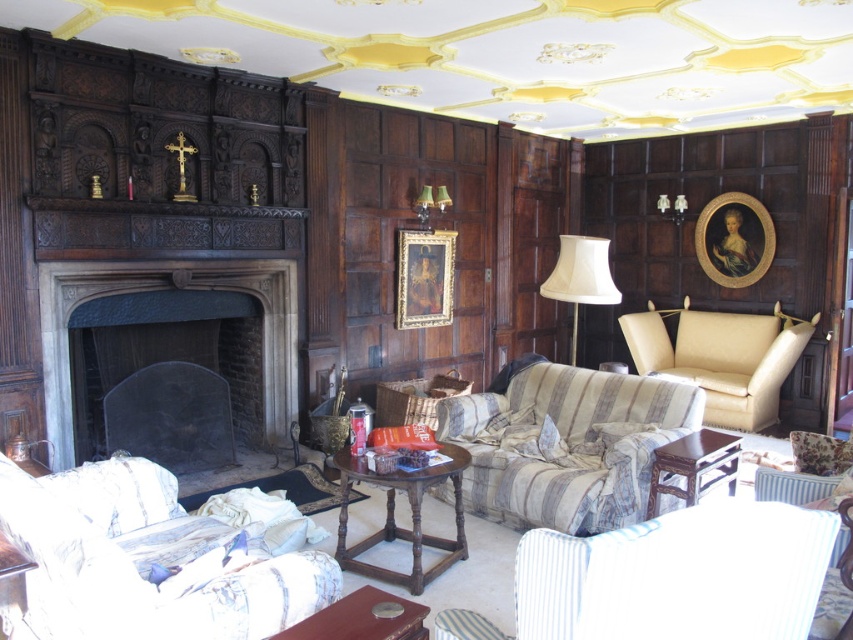
Question: Which object is farther from the camera taking this photo?

Choices:
 (A) dark brown stone fireplace at center
 (B) matte gold lampshade at upper center

Answer: (B)

Question: Which of these objects is positioned farthest from the beige leather armchair at right?

Choices:
 (A) striped fabric couch at center
 (B) dark brown stone fireplace at center

Answer: (B)

Question: Among these points, which one is nearest to the camera?

Choices:
 (A) (759, 326)
 (B) (421, 193)
 (C) (569, 294)
 (D) (749, 624)

Answer: (D)

Question: Is dark brown stone fireplace at center closer to camera compared to matte gold lampshade at upper center?

Choices:
 (A) yes
 (B) no

Answer: (A)

Question: Is white striped fabric armchair at lower left above dark brown stone fireplace at center?

Choices:
 (A) yes
 (B) no

Answer: (B)

Question: Is beige fabric lampshade at center positioned before green fabric lampshade at upper center?

Choices:
 (A) no
 (B) yes

Answer: (B)